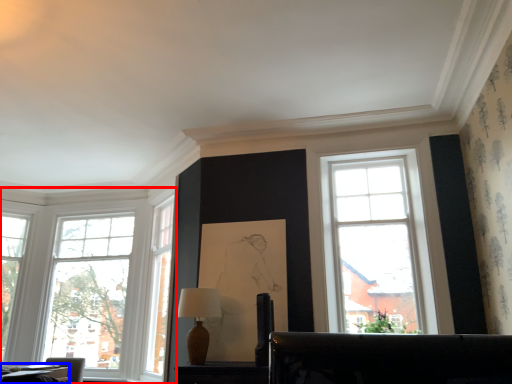
Question: Which of the following is the farthest to the observer, window (highlighted by a red box) or table (highlighted by a blue box)?

Choices:
 (A) window
 (B) table

Answer: (A)